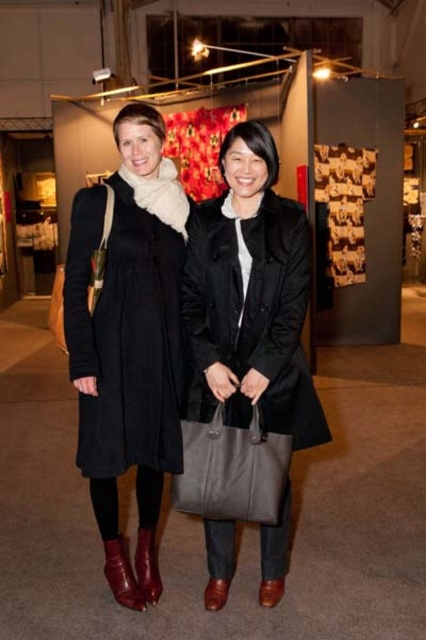
Does black woolen dress at left have a lesser height compared to leather tote at center?

No.

Is point (126, 417) farther from viewer compared to point (189, 492)?

Yes, point (126, 417) is behind point (189, 492).

The image size is (426, 640). In order to click on black woolen dress at left in this screenshot , I will do `click(127, 326)`.

Which is more to the right, leather boot at lower left or shiny brown leather boot at lower left?

shiny brown leather boot at lower left

Is leather boot at lower left bigger than shiny brown leather boot at lower left?

Yes, leather boot at lower left is bigger than shiny brown leather boot at lower left.

Between point (112, 582) and point (149, 586), which one is positioned in front?

Point (112, 582) is more forward.

Find the location of a particular element. This screenshot has height=640, width=426. leather boot at lower left is located at coordinates (121, 573).

Consider the image. Is black matte coat at center below leather tote at center?

No.

Is black matte coat at center above leather tote at center?

Yes, black matte coat at center is above leather tote at center.

Between point (210, 204) and point (235, 464), which one is positioned behind?

The point (210, 204) is more distant.

At what (x,y) coordinates should I click in order to perform the action: click on black matte coat at center. Please return your answer as a coordinate pair (x, y). This screenshot has height=640, width=426. Looking at the image, I should click on (252, 310).